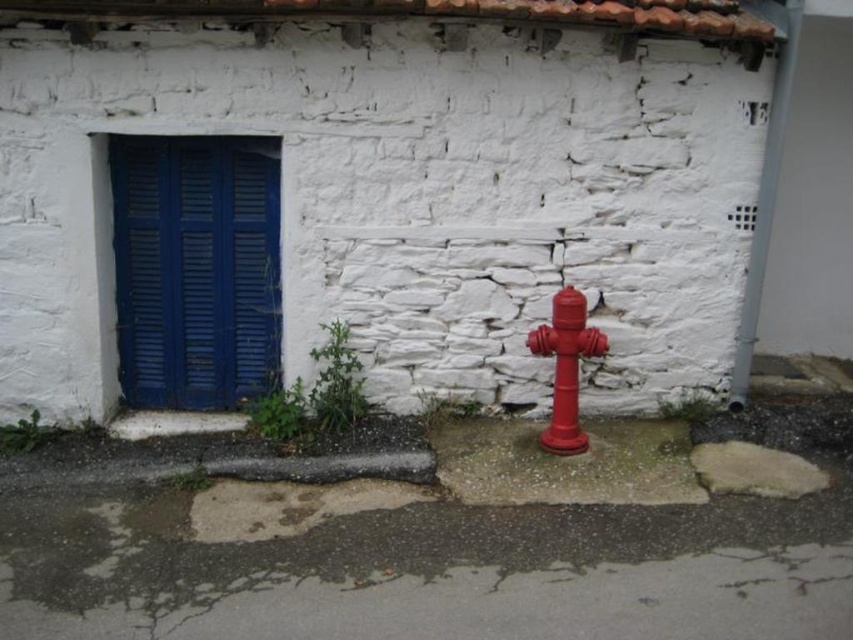
Where is `blue painted wood at left`? The image size is (853, 640). blue painted wood at left is located at coordinates (195, 269).

Is blue painted wood at left below smooth concrete curb at lower left?

Incorrect, blue painted wood at left is not positioned below smooth concrete curb at lower left.

Image resolution: width=853 pixels, height=640 pixels. Find the location of `blue painted wood at left`. blue painted wood at left is located at coordinates (195, 269).

Looking at this image, does blue painted wood at left appear over glossy metal hydrant at lower right?

Indeed, blue painted wood at left is positioned over glossy metal hydrant at lower right.

Is the position of blue painted wood at left more distant than that of glossy metal hydrant at lower right?

That is True.

Is point (270, 360) positioned after point (573, 308)?

Yes, it is.

Find the location of `blue painted wood at left`. blue painted wood at left is located at coordinates (195, 269).

Is glossy metal hydrant at lower right shorter than smooth concrete curb at lower left?

No, glossy metal hydrant at lower right is not shorter than smooth concrete curb at lower left.

Between glossy metal hydrant at lower right and smooth concrete curb at lower left, which one is positioned higher?

glossy metal hydrant at lower right is above.

Is point (601, 353) positioned behind point (132, 429)?

No.

The height and width of the screenshot is (640, 853). Identify the location of glossy metal hydrant at lower right. coord(566,365).